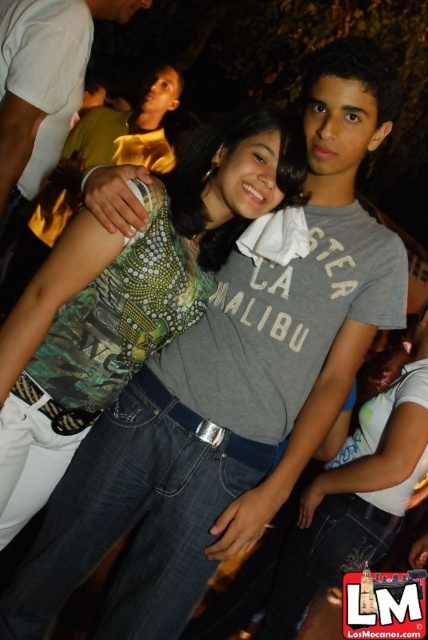
Which is below, green textured top at center or matte black shirt at upper center?

Positioned lower is green textured top at center.

Identify the location of green textured top at center. point(127,296).

At what (x,y) coordinates should I click in order to perform the action: click on green textured top at center. Please return your answer as a coordinate pair (x, y). Image resolution: width=428 pixels, height=640 pixels. Looking at the image, I should click on [127, 296].